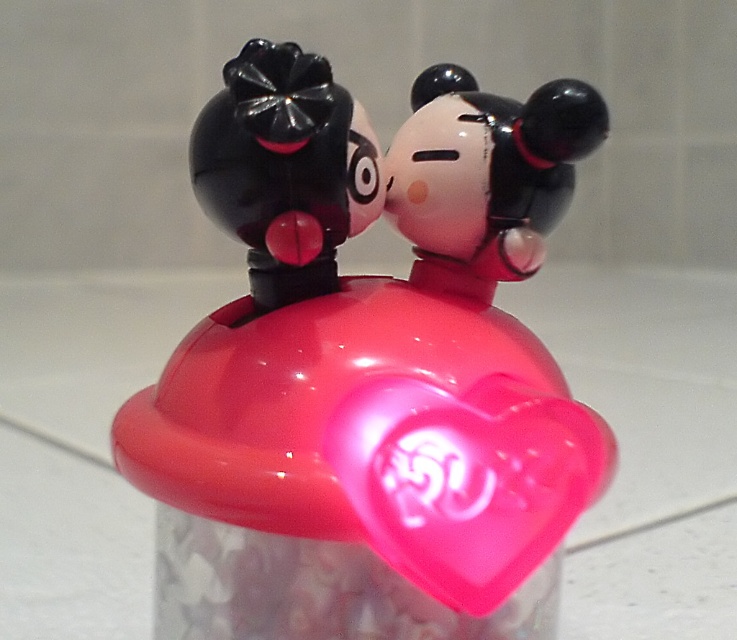
Find the location of a particular element. glossy plastic toy at center is located at coordinates (368, 371).

I want to click on glossy plastic toy at center, so click(x=368, y=371).

What are the coordinates of `glossy plastic toy at center` in the screenshot? It's located at (368, 371).

Between glossy plastic toy at center and glossy plastic heart at center, which one appears on the left side from the viewer's perspective?

glossy plastic toy at center

What do you see at coordinates (368, 371) in the screenshot? I see `glossy plastic toy at center` at bounding box center [368, 371].

The height and width of the screenshot is (640, 737). Find the location of `glossy plastic toy at center`. glossy plastic toy at center is located at coordinates (368, 371).

Is point (514, 420) in front of point (256, 292)?

Yes, point (514, 420) is closer to viewer.

Can you confirm if glossy plastic heart at center is shorter than glossy plastic figurine at upper left?

Correct, glossy plastic heart at center is not as tall as glossy plastic figurine at upper left.

Between point (441, 403) and point (315, 102), which one is positioned behind?

The point (441, 403) is more distant.

The height and width of the screenshot is (640, 737). Find the location of `glossy plastic heart at center`. glossy plastic heart at center is located at coordinates (467, 480).